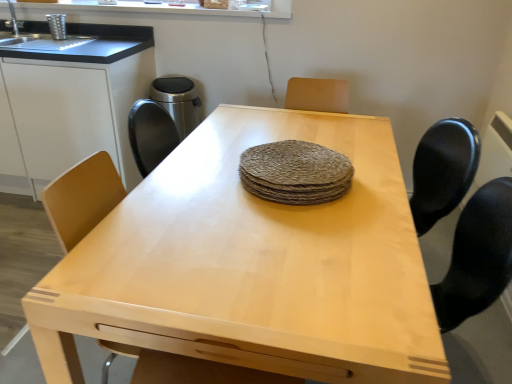
Question: Is rough woven placemat at center far from white matte cabinet at left?

Choices:
 (A) yes
 (B) no

Answer: (A)

Question: Does rough woven placemat at center have a larger size compared to white matte cabinet at left?

Choices:
 (A) yes
 (B) no

Answer: (B)

Question: Is rough woven placemat at center aimed at white matte cabinet at left?

Choices:
 (A) yes
 (B) no

Answer: (B)

Question: From the image's perspective, would you say rough woven placemat at center is shown under white matte cabinet at left?

Choices:
 (A) no
 (B) yes

Answer: (B)

Question: Considering the relative positions of rough woven placemat at center and white matte cabinet at left in the image provided, is rough woven placemat at center to the left of white matte cabinet at left from the viewer's perspective?

Choices:
 (A) no
 (B) yes

Answer: (A)

Question: Is white matte cabinet at left wider or thinner than rough woven placemat at center?

Choices:
 (A) wide
 (B) thin

Answer: (A)

Question: From a real-world perspective, relative to rough woven placemat at center, is white matte cabinet at left vertically above or below?

Choices:
 (A) above
 (B) below

Answer: (B)

Question: From the image's perspective, is white matte cabinet at left positioned above or below rough woven placemat at center?

Choices:
 (A) below
 (B) above

Answer: (B)

Question: Based on their positions, is white matte cabinet at left located to the left or right of rough woven placemat at center?

Choices:
 (A) right
 (B) left

Answer: (B)

Question: From the image's perspective, is rough woven placemat at center above or below white matte cabinet at left?

Choices:
 (A) above
 (B) below

Answer: (B)

Question: Considering the positions of rough woven placemat at center and white matte cabinet at left in the image, is rough woven placemat at center taller or shorter than white matte cabinet at left?

Choices:
 (A) tall
 (B) short

Answer: (B)

Question: Considering the positions of rough woven placemat at center and white matte cabinet at left in the image, is rough woven placemat at center bigger or smaller than white matte cabinet at left?

Choices:
 (A) big
 (B) small

Answer: (B)

Question: Considering the positions of point (272, 200) and point (62, 170), is point (272, 200) closer or farther from the camera than point (62, 170)?

Choices:
 (A) closer
 (B) farther

Answer: (A)

Question: From a real-world perspective, relative to light wood table at center, is rough woven placemat at center vertically above or below?

Choices:
 (A) below
 (B) above

Answer: (B)

Question: Based on their positions, is rough woven placemat at center located to the left or right of light wood table at center?

Choices:
 (A) left
 (B) right

Answer: (B)